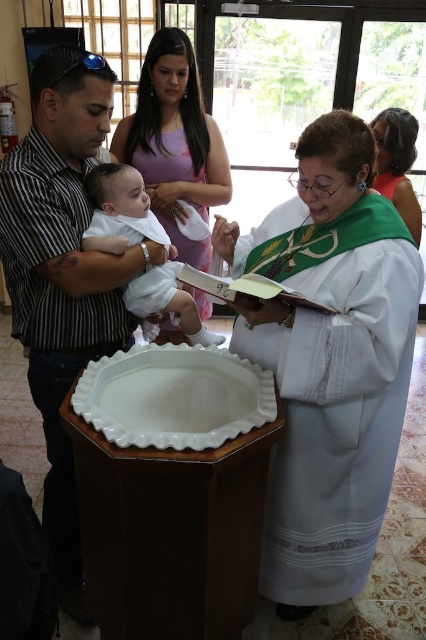
You are an interior designer observing the baptismal ceremony scene. You need to arrange a bouquet of flowers between the matte pink dress at upper center and the white matte robe at center. Since the bouquet is 1.2 meters tall, will it fit vertically between them without exceeding the height of the taller object?

The matte pink dress at upper center is taller than the white matte robe at center. Since the bouquet is 1.2 meters tall, it will exceed the height of the taller object, so it won

You are an interior designer planning to place a decorative item between the matte black shirt at left and the green satin dress at upper right. Which object should you place closer to the center of the room to ensure balance?

The matte black shirt at left is wider than the green satin dress at upper right. To balance the composition, place the wider matte black shirt at left closer to the center so its greater width visually counterbalances the narrower green satin dress at upper right.